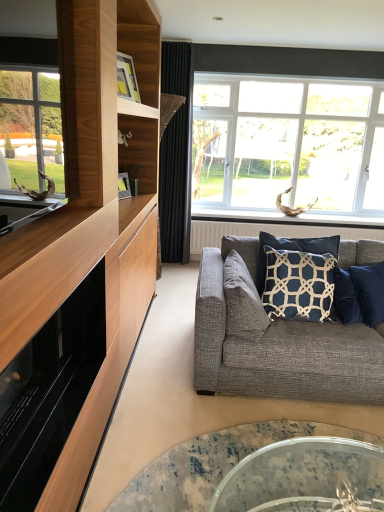
Question: Is the depth of white plastic window at upper right greater than that of matte black fireplace at left?

Choices:
 (A) no
 (B) yes

Answer: (B)

Question: Would you say white plastic window at upper right contains matte black fireplace at left?

Choices:
 (A) yes
 (B) no

Answer: (B)

Question: Is white plastic window at upper right oriented away from matte black fireplace at left?

Choices:
 (A) no
 (B) yes

Answer: (A)

Question: From the image's perspective, is white plastic window at upper right located beneath matte black fireplace at left?

Choices:
 (A) no
 (B) yes

Answer: (A)

Question: Is white plastic window at upper right touching matte black fireplace at left?

Choices:
 (A) yes
 (B) no

Answer: (B)

Question: From a real-world perspective, is textured gray pillow at center, which is the 2th pillow from right to left, physically located above or below white textured radiator at center?

Choices:
 (A) below
 (B) above

Answer: (B)

Question: Is textured gray pillow at center, the 1th pillow viewed from the left, taller or shorter than white textured radiator at center?

Choices:
 (A) tall
 (B) short

Answer: (B)

Question: Is textured gray pillow at center, which is the 2th pillow from right to left, inside or outside of white textured radiator at center?

Choices:
 (A) outside
 (B) inside

Answer: (A)

Question: Looking at their shapes, would you say textured gray pillow at center, the 1th pillow viewed from the left, is wider or thinner than white textured radiator at center?

Choices:
 (A) thin
 (B) wide

Answer: (B)

Question: In terms of height, does white textured radiator at center look taller or shorter compared to white plastic window at upper right?

Choices:
 (A) tall
 (B) short

Answer: (B)

Question: Is white textured radiator at center to the left or to the right of white plastic window at upper right in the image?

Choices:
 (A) left
 (B) right

Answer: (A)

Question: From the image's perspective, is white textured radiator at center above or below white plastic window at upper right?

Choices:
 (A) above
 (B) below

Answer: (B)

Question: From a real-world perspective, is white textured radiator at center positioned above or below white plastic window at upper right?

Choices:
 (A) below
 (B) above

Answer: (A)

Question: From their relative heights in the image, would you say dark blue fabric pillow at center, the first pillow positioned from the right, is taller or shorter than matte black fireplace at left?

Choices:
 (A) short
 (B) tall

Answer: (B)

Question: From a real-world perspective, is dark blue fabric pillow at center, the first pillow positioned from the right, physically located above or below matte black fireplace at left?

Choices:
 (A) above
 (B) below

Answer: (B)